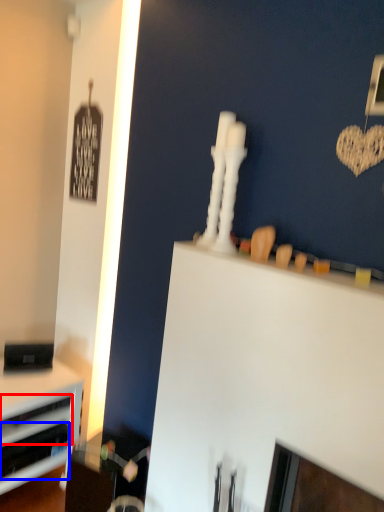
Question: Which point is closer to the camera, drawer (highlighted by a red box) or drawer (highlighted by a blue box)?

Choices:
 (A) drawer
 (B) drawer

Answer: (B)